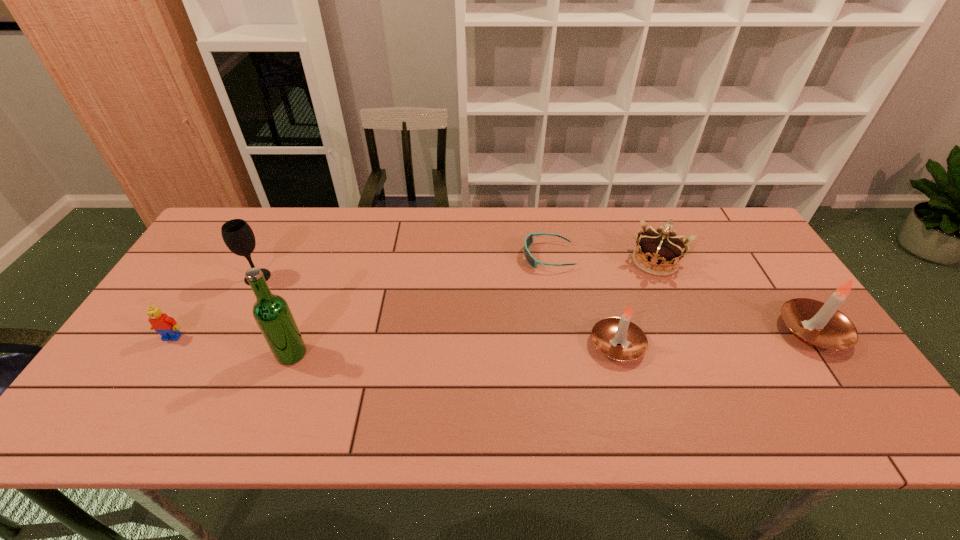
Image resolution: width=960 pixels, height=540 pixels. Find the location of `the left candle`. the left candle is located at coordinates (618, 338).

Image resolution: width=960 pixels, height=540 pixels. Find the location of `the shorter candle`. the shorter candle is located at coordinates (618, 338).

In order to click on the right candle in this screenshot , I will do `click(821, 325)`.

The image size is (960, 540). I want to click on the taller candle, so click(821, 325).

Find the location of a particular element. Image resolution: width=960 pixels, height=540 pixels. sunglasses is located at coordinates (528, 242).

In order to click on the sixth object from right to left in this screenshot , I will do `click(238, 236)`.

In order to click on Lego in this screenshot , I will do `click(167, 327)`.

Image resolution: width=960 pixels, height=540 pixels. I want to click on the second object from right to left, so click(x=657, y=250).

Find the location of `beer bottle`. beer bottle is located at coordinates (271, 312).

The height and width of the screenshot is (540, 960). I want to click on the tallest object, so click(x=271, y=312).